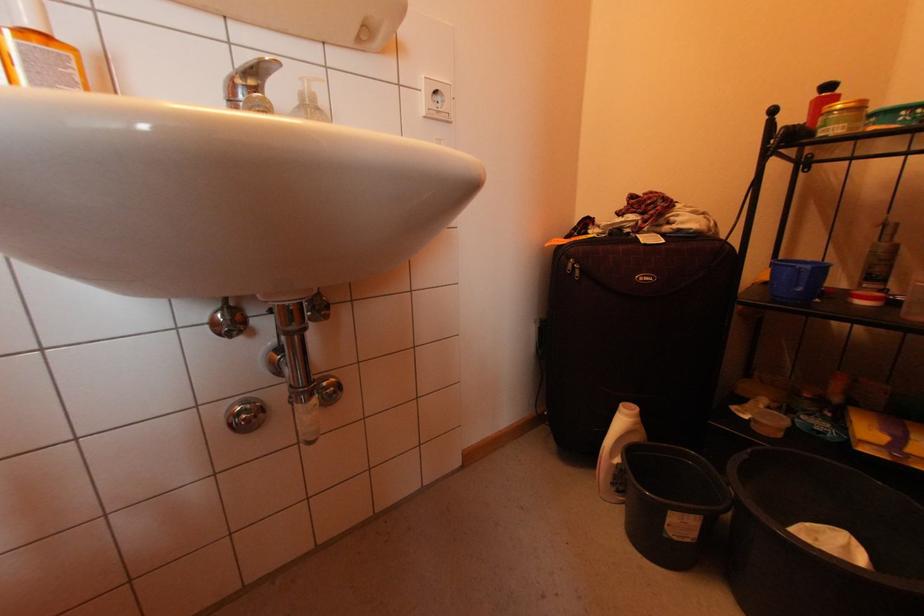
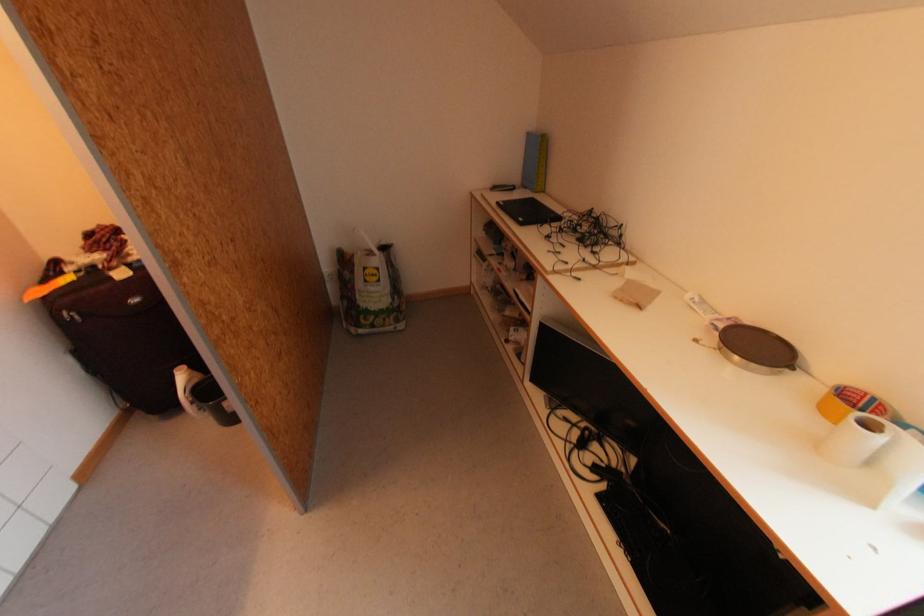
Based on the continuous images, in which direction is the camera rotating?

The camera's rotation is toward right-down.